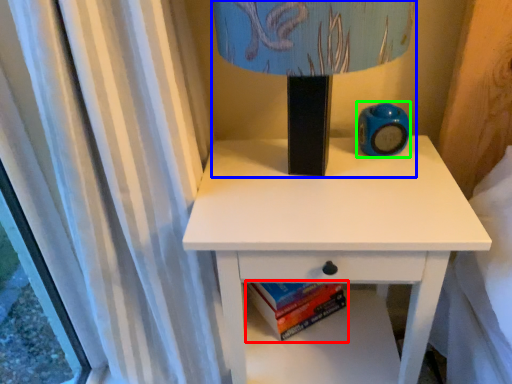
Question: Which is farther away from paperback book (highlighted by a red box)? table lamp (highlighted by a blue box) or teal (highlighted by a green box)?

Choices:
 (A) table lamp
 (B) teal

Answer: (A)